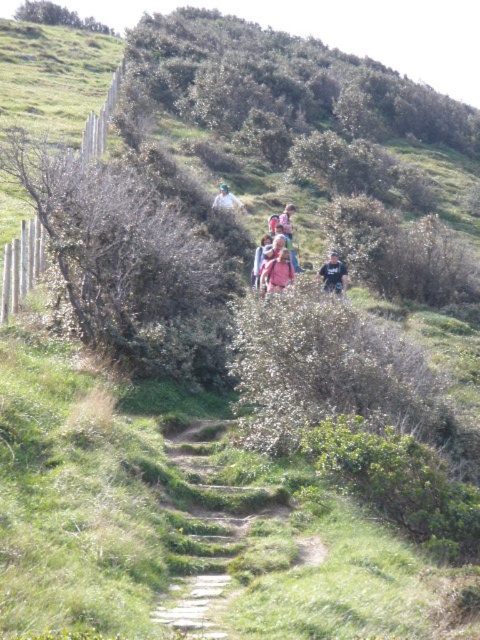
Does point (275, 257) come in front of point (342, 288)?

Yes, it is.

Looking at this image, is pink fabric at center closer to camera compared to dark blue jacket at center?

Yes, it is.

In order to click on pink fabric at center in this screenshot , I will do `click(276, 252)`.

Locate an element on the screen. pink fabric at center is located at coordinates click(276, 252).

Based on the photo, between green mossy stone steps at center and matte pink shirt at center, which one is positioned lower?

green mossy stone steps at center is lower down.

How distant is green mossy stone steps at center from matte pink shirt at center?

green mossy stone steps at center and matte pink shirt at center are 25.14 feet apart from each other.

Is point (180, 436) positioned behind point (291, 266)?

No, (180, 436) is in front of (291, 266).

Identify the location of green mossy stone steps at center. (195, 604).

Which is more to the right, green mossy stone steps at center or dark blue jacket at center?

From the viewer's perspective, dark blue jacket at center appears more on the right side.

Which is in front, point (187, 609) or point (324, 273)?

Positioned in front is point (187, 609).

The width and height of the screenshot is (480, 640). What are the coordinates of `green mossy stone steps at center` in the screenshot? It's located at (195, 604).